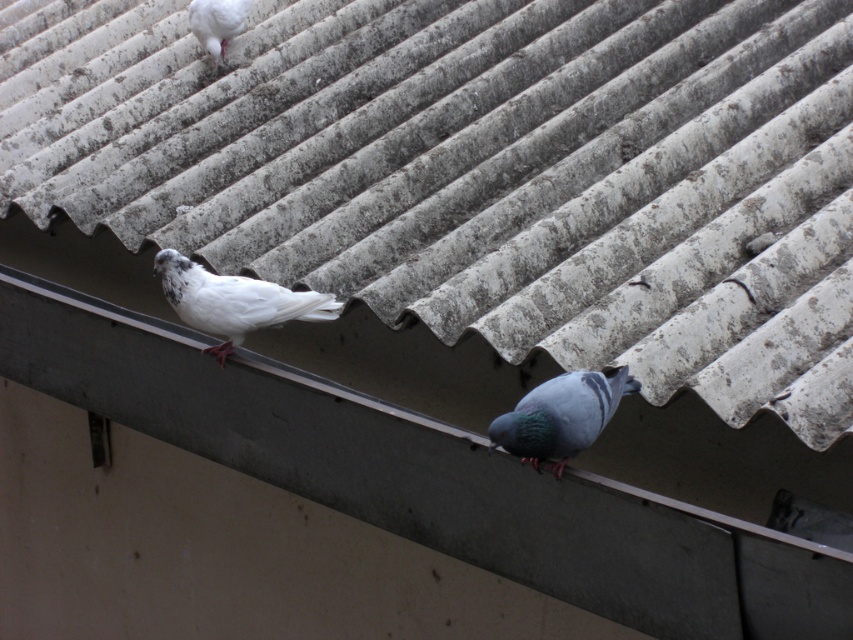
Can you confirm if white matte bird at center is thinner than shiny blue pigeon at center?

In fact, white matte bird at center might be wider than shiny blue pigeon at center.

Can you confirm if white matte bird at center is positioned above shiny blue pigeon at center?

Correct, white matte bird at center is located above shiny blue pigeon at center.

Who is more forward, (x=263, y=282) or (x=608, y=417)?

Positioned in front is point (x=608, y=417).

Image resolution: width=853 pixels, height=640 pixels. In order to click on white matte bird at center in this screenshot , I will do `click(233, 301)`.

Describe the element at coordinates (561, 416) in the screenshot. The image size is (853, 640). I see `shiny blue pigeon at center` at that location.

Is shiny blue pigeon at center positioned behind white matte pigeon at upper left?

No, shiny blue pigeon at center is in front of white matte pigeon at upper left.

Is point (556, 442) positioned in front of point (212, 8)?

That is True.

Find the location of a particular element. The width and height of the screenshot is (853, 640). shiny blue pigeon at center is located at coordinates (561, 416).

Does white corrugated metal at upper center have a greater width compared to white matte bird at center?

Yes.

What are the coordinates of `white corrugated metal at upper center` in the screenshot? It's located at (480, 172).